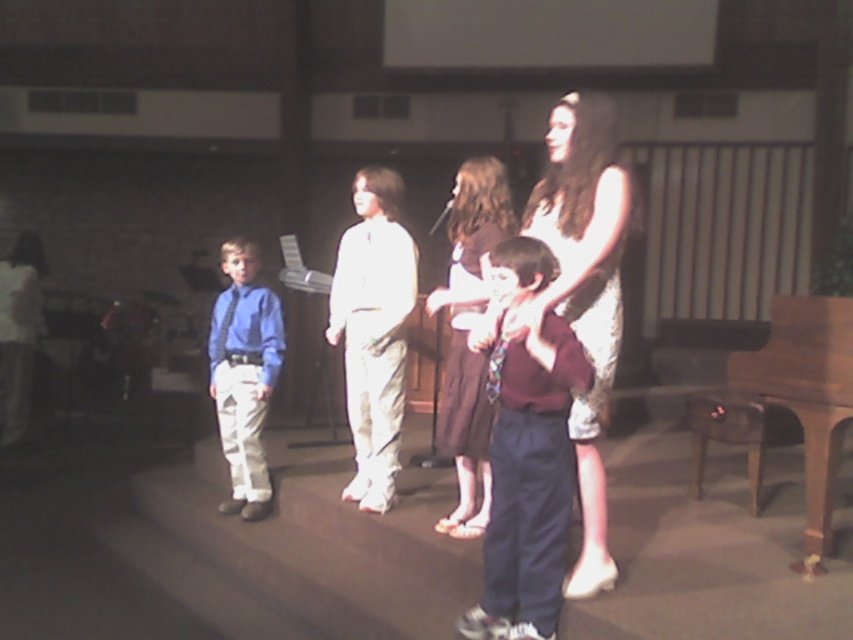
You are a photographer setting up for a group photo. You see the white cotton pants at center and the matte brown dress at center. Which clothing item is smaller in size?

The white cotton pants at center has a smaller size compared to the matte brown dress at center.

You are standing in the dimly lit indoor space and want to determine which of the two points, point (590, 504) or point (444, 416), is closer to you. Based on the scene description, which point is nearer?

Point (590, 504) is closer to the viewer than point (444, 416).